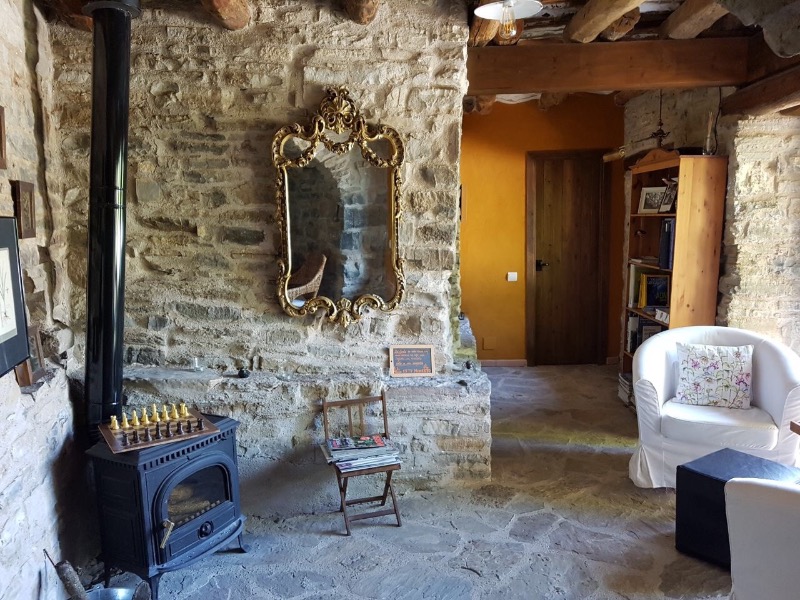
Identify the location of long stove pipe. (108, 186).